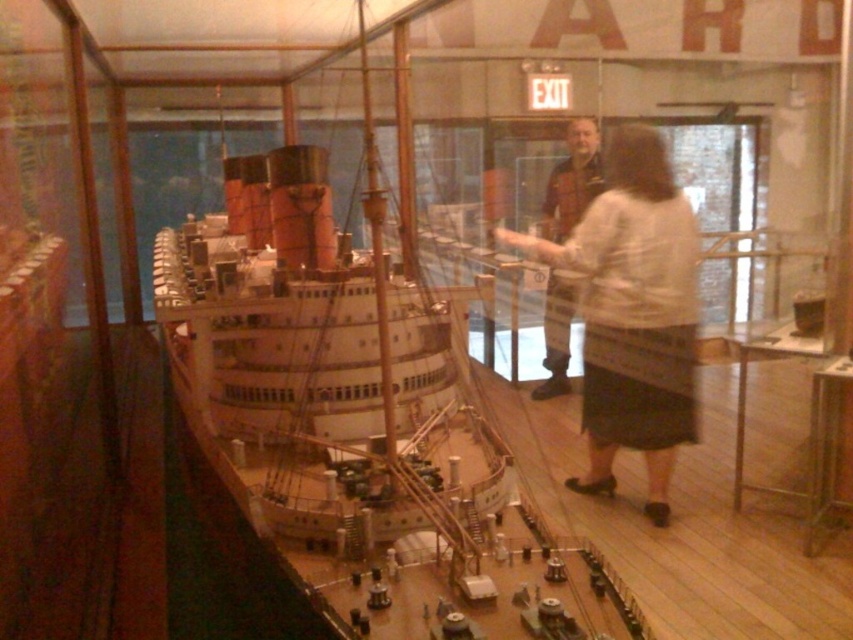
Question: Which object is farther from the camera taking this photo?

Choices:
 (A) white textured sweater at center
 (B) polished wood floor at center
 (C) white matte ship at center

Answer: (B)

Question: Which is nearer to the white textured sweater at center?

Choices:
 (A) polished wood floor at center
 (B) white matte ship at center

Answer: (B)

Question: Does white matte ship at center have a greater width compared to polished wood floor at center?

Choices:
 (A) no
 (B) yes

Answer: (B)

Question: Does white matte ship at center have a smaller size compared to polished wood floor at center?

Choices:
 (A) yes
 (B) no

Answer: (B)

Question: Which object is positioned farthest from the polished wood floor at center?

Choices:
 (A) white matte ship at center
 (B) white textured sweater at center

Answer: (A)

Question: Is white matte ship at center above white textured sweater at center?

Choices:
 (A) no
 (B) yes

Answer: (B)